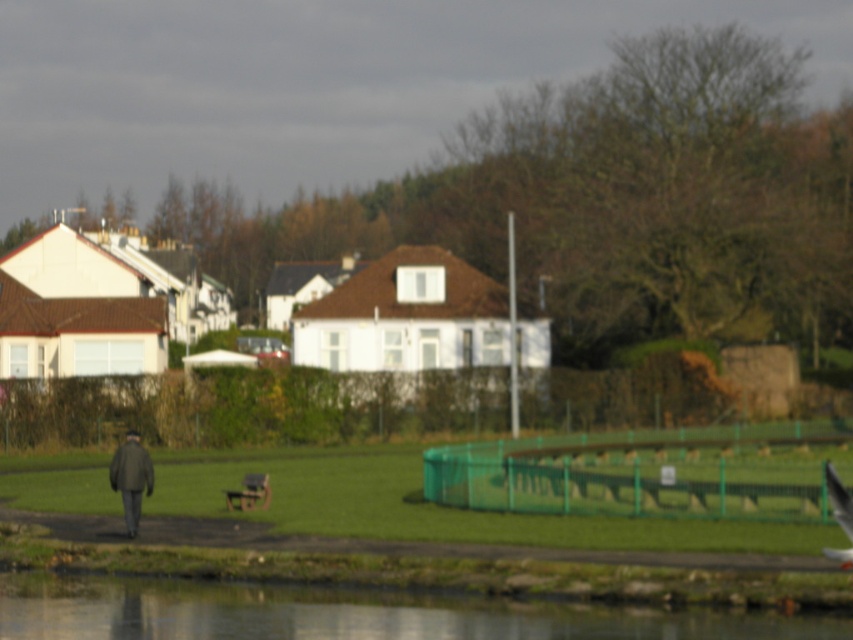
Does dark gray wool coat at lower left come behind wooden park bench at center?

No, dark gray wool coat at lower left is closer to the viewer.

Is point (132, 492) positioned in front of point (254, 502)?

Yes, point (132, 492) is in front of point (254, 502).

Is point (141, 449) positioned behind point (248, 472)?

No, (141, 449) is closer to viewer.

Image resolution: width=853 pixels, height=640 pixels. In order to click on dark gray wool coat at lower left in this screenshot , I will do tap(131, 477).

Between point (120, 461) and point (842, 490), which one is positioned in front?

Point (842, 490) is in front.

Does dark gray wool coat at lower left have a lesser width compared to white feathered bird at lower right?

In fact, dark gray wool coat at lower left might be wider than white feathered bird at lower right.

Is point (140, 481) closer to viewer compared to point (848, 554)?

No, (140, 481) is further to viewer.

The width and height of the screenshot is (853, 640). I want to click on dark gray wool coat at lower left, so click(x=131, y=477).

Can you confirm if white feathered bird at lower right is thinner than wooden park bench at center?

Incorrect, white feathered bird at lower right's width is not less than wooden park bench at center's.

Which of these two, white feathered bird at lower right or wooden park bench at center, stands shorter?

wooden park bench at center

Is point (846, 504) positioned after point (250, 472)?

That is False.

The height and width of the screenshot is (640, 853). I want to click on white feathered bird at lower right, so click(x=838, y=499).